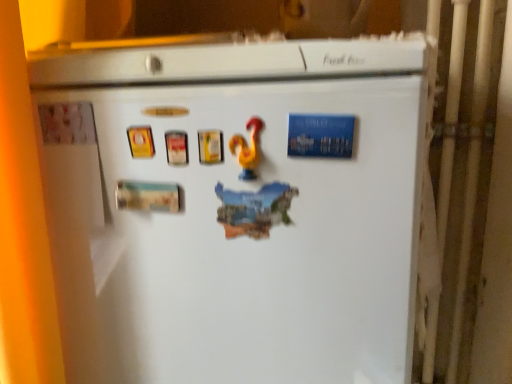
Identify the location of yellow rubber duck at center. (248, 149).

Describe the element at coordinates (248, 149) in the screenshot. I see `yellow rubber duck at center` at that location.

Where is `white matte refrigerator at center`? white matte refrigerator at center is located at coordinates (234, 207).

Describe the element at coordinates (234, 207) in the screenshot. I see `white matte refrigerator at center` at that location.

Locate an element on the screen. The image size is (512, 384). yellow rubber duck at center is located at coordinates (248, 149).

Is yellow rubber duck at center to the left of white matte refrigerator at center from the viewer's perspective?

No.

Consider the image. Which object is more forward, yellow rubber duck at center or white matte refrigerator at center?

white matte refrigerator at center is in front.

Considering the positions of point (246, 159) and point (54, 163), is point (246, 159) closer or farther from the camera than point (54, 163)?

Point (246, 159) is closer to the camera than point (54, 163).

From the image's perspective, which one is positioned higher, yellow rubber duck at center or white matte refrigerator at center?

yellow rubber duck at center, from the image's perspective.

From a real-world perspective, is yellow rubber duck at center positioned over white matte refrigerator at center based on gravity?

Correct, in the physical world, yellow rubber duck at center is higher than white matte refrigerator at center.

Can you confirm if yellow rubber duck at center is thinner than white matte refrigerator at center?

Yes, yellow rubber duck at center is thinner than white matte refrigerator at center.

Which of these two, yellow rubber duck at center or white matte refrigerator at center, stands shorter?

yellow rubber duck at center is shorter.

Looking at the image, does yellow rubber duck at center seem bigger or smaller compared to white matte refrigerator at center?

yellow rubber duck at center is smaller than white matte refrigerator at center.

Is white matte refrigerator at center inside yellow rubber duck at center?

That's incorrect, white matte refrigerator at center is not inside yellow rubber duck at center.

Is yellow rubber duck at center placed right next to white matte refrigerator at center?

No, yellow rubber duck at center is not beside white matte refrigerator at center.

Is yellow rubber duck at center looking in the opposite direction of white matte refrigerator at center?

Yes, yellow rubber duck at center is facing away from white matte refrigerator at center.

How many degrees apart are the facing directions of yellow rubber duck at center and white matte refrigerator at center?

The angular difference between yellow rubber duck at center and white matte refrigerator at center is 0.191 degrees.

You are a GUI agent. You are given a task and a screenshot of the screen. Output one action in this format:
    pyautogui.click(x=<x>, y=<y>)
    Task: Click on the refrigerator in front of the yellow rubber duck at center
    This screenshot has height=384, width=512.
    Given the screenshot: What is the action you would take?
    pyautogui.click(x=234, y=207)

Based on the photo, does white matte refrigerator at center appear on the right side of yellow rubber duck at center?

No.

Between white matte refrigerator at center and yellow rubber duck at center, which one is positioned in front?

white matte refrigerator at center.

Which is behind, point (161, 52) or point (252, 161)?

Positioned behind is point (161, 52).

From the image's perspective, which is above, white matte refrigerator at center or yellow rubber duck at center?

From the image's view, yellow rubber duck at center is above.

From a real-world perspective, relative to yellow rubber duck at center, is white matte refrigerator at center vertically above or below?

white matte refrigerator at center is below yellow rubber duck at center.

Between white matte refrigerator at center and yellow rubber duck at center, which one has larger width?

Wider between the two is white matte refrigerator at center.

Who is taller, white matte refrigerator at center or yellow rubber duck at center?

white matte refrigerator at center.

Considering the sizes of objects white matte refrigerator at center and yellow rubber duck at center in the image provided, who is smaller, white matte refrigerator at center or yellow rubber duck at center?

Smaller between the two is yellow rubber duck at center.

Is white matte refrigerator at center inside the boundaries of yellow rubber duck at center, or outside?

The correct answer is: outside.

Is white matte refrigerator at center far away from yellow rubber duck at center?

They are positioned close to each other.

Does white matte refrigerator at center turn towards yellow rubber duck at center?

Yes.

How many degrees apart are the facing directions of white matte refrigerator at center and yellow rubber duck at center?

They differ by 0.191 degrees in their facing directions.

The height and width of the screenshot is (384, 512). Find the location of `refrigerator located in front of the yellow rubber duck at center`. refrigerator located in front of the yellow rubber duck at center is located at coordinates (234, 207).

Image resolution: width=512 pixels, height=384 pixels. I want to click on refrigerator in front of the yellow rubber duck at center, so click(234, 207).

Where is `toy on the right of white matte refrigerator at center`? toy on the right of white matte refrigerator at center is located at coordinates (248, 149).